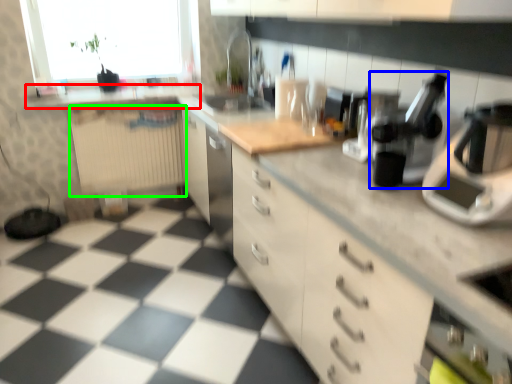
Question: Which object is positioned farthest from counter top (highlighted by a red box)? Select from coffee machine (highlighted by a blue box) and radiator (highlighted by a green box).

Choices:
 (A) coffee machine
 (B) radiator

Answer: (A)